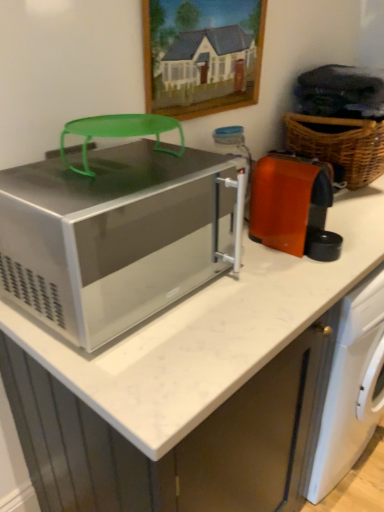
What are the coordinates of `orange glossy coffee maker at right` in the screenshot? It's located at (289, 201).

This screenshot has height=512, width=384. I want to click on satin silver microwave at center, so click(x=114, y=236).

Would you say wooden framed painting at upper center is a long distance from woven brown basket at right?

They are positioned close to each other.

Based on the photo, from the image's perspective, which is above, wooden framed painting at upper center or woven brown basket at right?

From the image's view, wooden framed painting at upper center is above.

From a real-world perspective, is wooden framed painting at upper center on woven brown basket at right?

Indeed, from a real-world perspective, wooden framed painting at upper center stands above woven brown basket at right.

Looking at this image, from the image's perspective, which one is positioned higher, orange glossy coffee maker at right or wooden framed painting at upper center?

wooden framed painting at upper center appears higher in the image.

From a real-world perspective, between orange glossy coffee maker at right and wooden framed painting at upper center, who is vertically higher?

wooden framed painting at upper center, from a real-world perspective.

Which is more to the left, orange glossy coffee maker at right or wooden framed painting at upper center?

From the viewer's perspective, wooden framed painting at upper center appears more on the left side.

Considering the relative sizes of orange glossy coffee maker at right and wooden framed painting at upper center in the image provided, is orange glossy coffee maker at right taller than wooden framed painting at upper center?

In fact, orange glossy coffee maker at right may be shorter than wooden framed painting at upper center.

Where is `basket on the right of orange glossy coffee maker at right`? The image size is (384, 512). basket on the right of orange glossy coffee maker at right is located at coordinates 341,146.

Is point (261, 228) positioned in front of point (373, 125)?

Yes, it is in front of point (373, 125).

Between orange glossy coffee maker at right and woven brown basket at right, which one appears on the left side from the viewer's perspective?

Positioned to the left is orange glossy coffee maker at right.

Which is more to the left, woven brown basket at right or wooden framed painting at upper center?

wooden framed painting at upper center is more to the left.

Is woven brown basket at right positioned before wooden framed painting at upper center?

No, woven brown basket at right is behind wooden framed painting at upper center.

Can you see woven brown basket at right touching wooden framed painting at upper center?

There is a gap between woven brown basket at right and wooden framed painting at upper center.

From a real-world perspective, between woven brown basket at right and wooden framed painting at upper center, who is vertically higher?

wooden framed painting at upper center, from a real-world perspective.

Which of these two, orange glossy coffee maker at right or satin silver microwave at center, is thinner?

orange glossy coffee maker at right.

Based on the photo, could satin silver microwave at center be considered to be inside orange glossy coffee maker at right?

No, satin silver microwave at center is not surrounded by orange glossy coffee maker at right.

In the scene shown: How many degrees apart are the facing directions of orange glossy coffee maker at right and satin silver microwave at center?

The angular difference between orange glossy coffee maker at right and satin silver microwave at center is 2.06 degrees.

Where is `appliance below the satin silver microwave at center (from a real-world perspective)`? This screenshot has width=384, height=512. appliance below the satin silver microwave at center (from a real-world perspective) is located at coordinates (289, 201).

How far apart are orange glossy coffee maker at right and white marble countertop at center?

23.48 centimeters.

Between orange glossy coffee maker at right and white marble countertop at center, which one has smaller width?

With smaller width is orange glossy coffee maker at right.

Is orange glossy coffee maker at right bigger or smaller than white marble countertop at center?

orange glossy coffee maker at right is smaller than white marble countertop at center.

Is point (299, 214) positioned before point (100, 370)?

That is False.

How different are the orientations of satin silver microwave at center and orange glossy coffee maker at right in degrees?

They differ by 2.06 degrees in their facing directions.

Is there a large distance between satin silver microwave at center and orange glossy coffee maker at right?

No, satin silver microwave at center is not far from orange glossy coffee maker at right.

Considering the sizes of objects satin silver microwave at center and orange glossy coffee maker at right in the image provided, who is bigger, satin silver microwave at center or orange glossy coffee maker at right?

With larger size is satin silver microwave at center.

Is orange glossy coffee maker at right a part of satin silver microwave at center?

Answer: No, orange glossy coffee maker at right is not surrounded by satin silver microwave at center.

Find the location of a particular element. The width and height of the screenshot is (384, 512). basket located on the right of wooden framed painting at upper center is located at coordinates (341, 146).

Find the location of a particular element. The width and height of the screenshot is (384, 512). appliance in front of the wooden framed painting at upper center is located at coordinates (289, 201).

Which object lies further to the anchor point woven brown basket at right, satin silver microwave at center or wooden framed painting at upper center?

Based on the image, satin silver microwave at center appears to be further to woven brown basket at right.

Based on their spatial positions, is white marble countertop at center or wooden framed painting at upper center closer to woven brown basket at right?

wooden framed painting at upper center.

Based on their spatial positions, is satin silver microwave at center or wooden framed painting at upper center closer to orange glossy coffee maker at right?

Based on the image, satin silver microwave at center appears to be nearer to orange glossy coffee maker at right.

Looking at the image, which one is located further to wooden framed painting at upper center, white marble countertop at center or satin silver microwave at center?

white marble countertop at center is positioned further to the anchor wooden framed painting at upper center.

Looking at the image, which one is located further to wooden framed painting at upper center, satin silver microwave at center or white marble countertop at center?

white marble countertop at center lies further to wooden framed painting at upper center than the other object.

Which object lies further to the anchor point orange glossy coffee maker at right, woven brown basket at right or wooden framed painting at upper center?

woven brown basket at right.

Considering their positions, is wooden framed painting at upper center positioned closer to satin silver microwave at center than woven brown basket at right?

wooden framed painting at upper center.

Which object lies further to the anchor point woven brown basket at right, orange glossy coffee maker at right or satin silver microwave at center?

satin silver microwave at center is positioned further to the anchor woven brown basket at right.

The image size is (384, 512). I want to click on appliance between white marble countertop at center and woven brown basket at right in the front-back direction, so pos(289,201).

Image resolution: width=384 pixels, height=512 pixels. I want to click on basket between wooden framed painting at upper center and white marble countertop at center in the up-down direction, so click(341, 146).

This screenshot has width=384, height=512. In order to click on appliance between wooden framed painting at upper center and woven brown basket at right in this screenshot , I will do `click(289, 201)`.

The image size is (384, 512). What are the coordinates of `appliance between wooden framed painting at upper center and satin silver microwave at center in the up-down direction` in the screenshot? It's located at (289, 201).